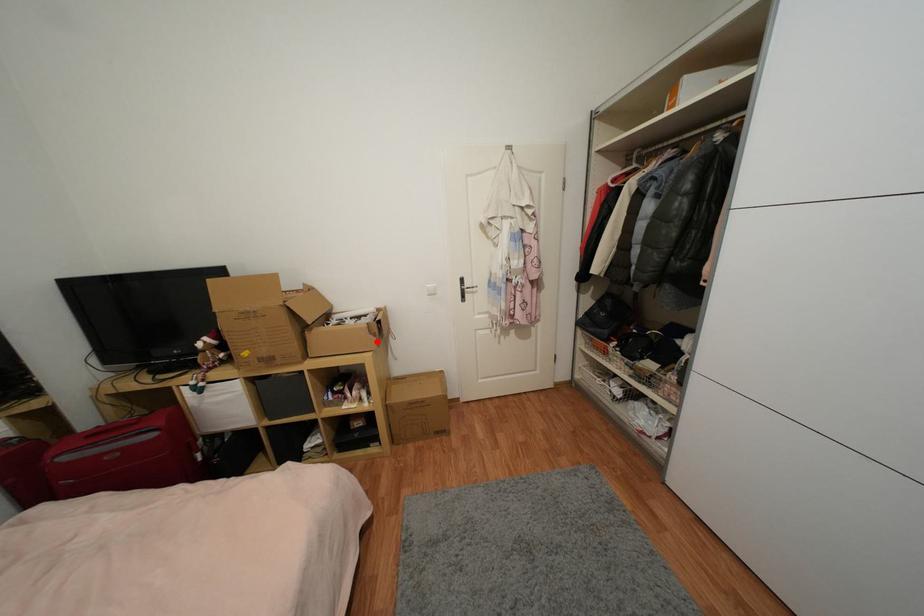
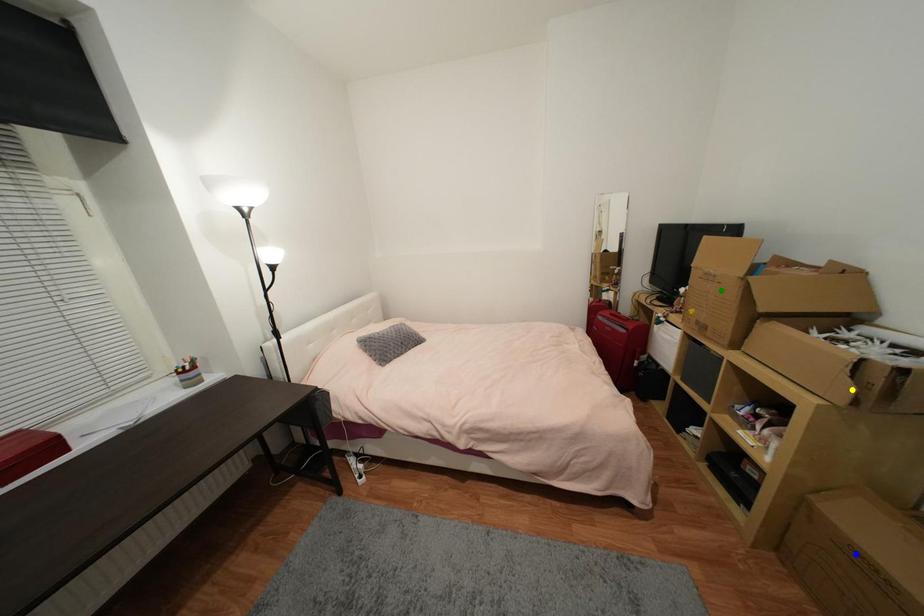
Question: I am providing you with two images of the same scene from different viewpoints. A red point is marked on the first image. You are given multiple points on the second image. Which point in image 2 represents the same 3d spot as the red point in image 1?

Choices:
 (A) blue point
 (B) yellow point
 (C) green point

Answer: (B)